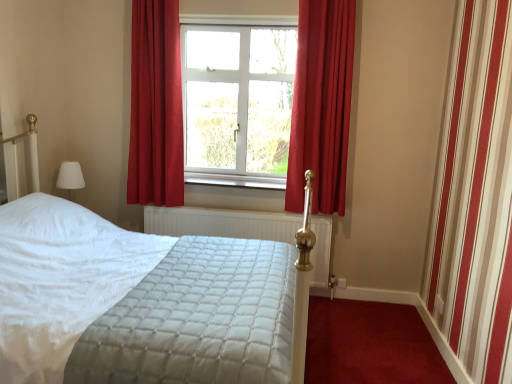
Where is `vacant region above white plastic window at center (from a real-world perspective)`? This screenshot has height=384, width=512. vacant region above white plastic window at center (from a real-world perspective) is located at coordinates (224, 13).